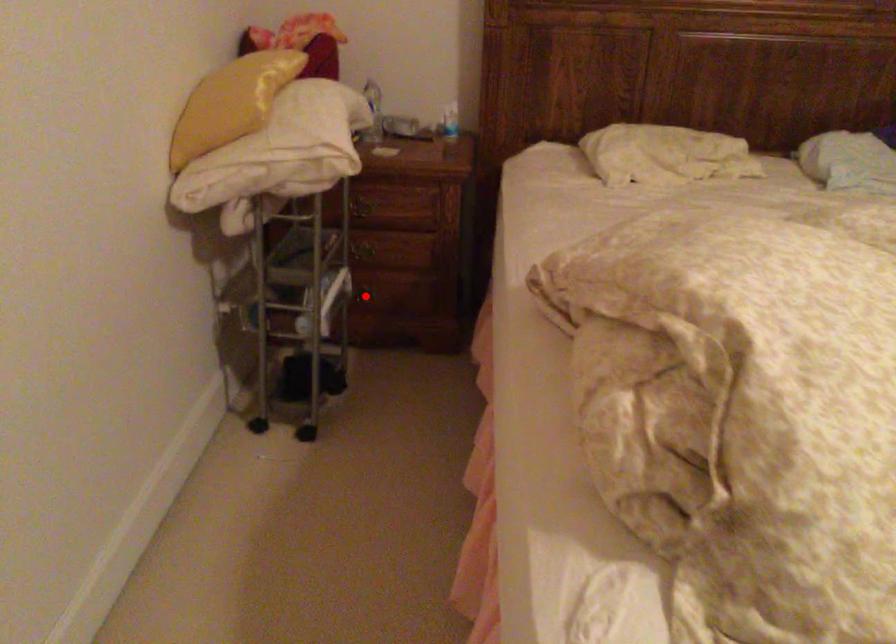
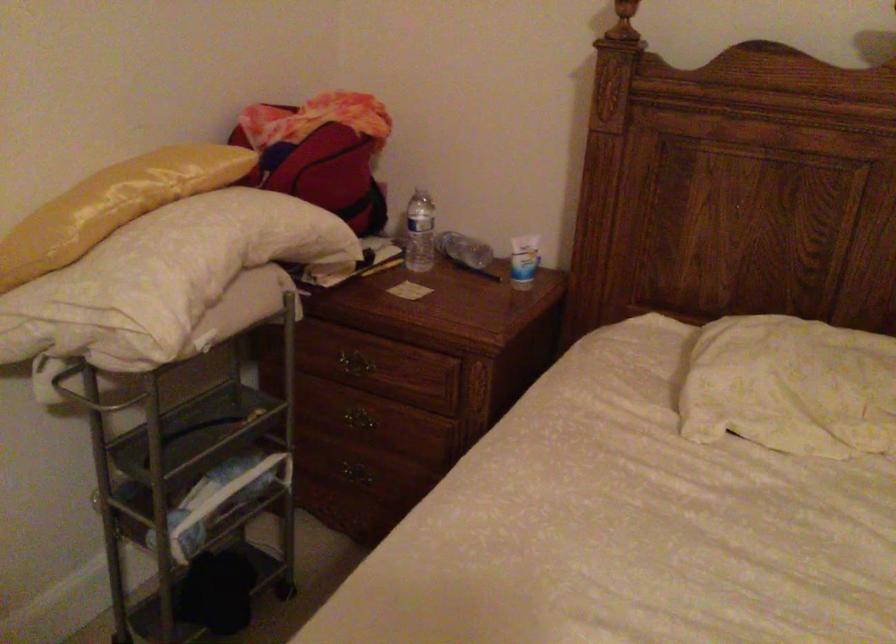
Find the pixel in the second image that matches the highlighted location in the first image.

(355, 473)